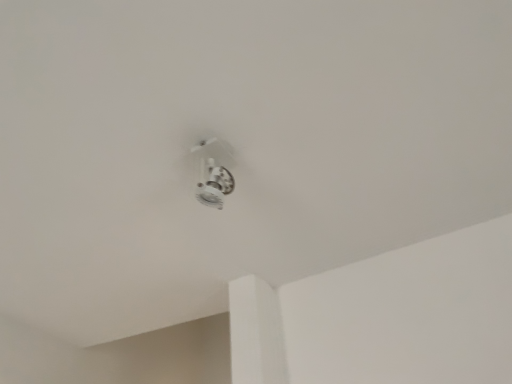
I want to click on satin nickel fixture at upper center, so click(x=213, y=182).

Image resolution: width=512 pixels, height=384 pixels. Describe the element at coordinates (213, 182) in the screenshot. I see `satin nickel fixture at upper center` at that location.

The height and width of the screenshot is (384, 512). I want to click on satin nickel fixture at upper center, so click(213, 182).